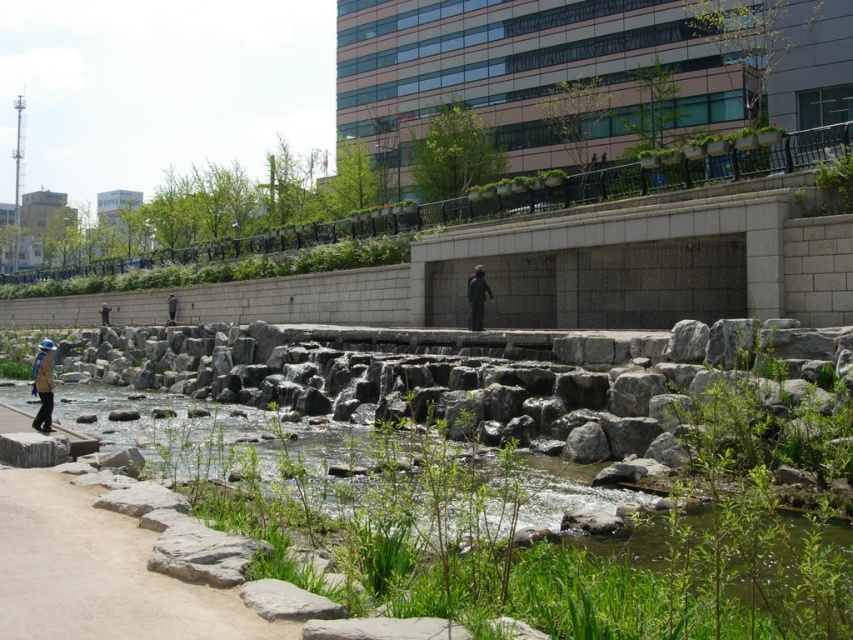
Question: Does sandy beige path at lower left lie in front of blue fabric hat at left?

Choices:
 (A) yes
 (B) no

Answer: (A)

Question: Where is blue fabric hat at left located in relation to dark gray suit at center in the image?

Choices:
 (A) above
 (B) below

Answer: (B)

Question: Among these objects, which one is nearest to the camera?

Choices:
 (A) green grassy waterway at lower left
 (B) dark gray suit at center
 (C) blue fabric hat at left

Answer: (A)

Question: Which object is positioned farthest from the sandy beige path at lower left?

Choices:
 (A) dark gray suit at center
 (B) green grassy waterway at lower left
 (C) dark gray concrete person at center
 (D) blue fabric hat at left

Answer: (C)

Question: Considering the relative positions of blue fabric hat at left and dark gray concrete person at center in the image provided, where is blue fabric hat at left located with respect to dark gray concrete person at center?

Choices:
 (A) left
 (B) right

Answer: (A)

Question: Estimate the real-world distances between objects in this image. Which object is farther from the sandy beige path at lower left?

Choices:
 (A) dark gray suit at center
 (B) green grassy waterway at lower left

Answer: (A)